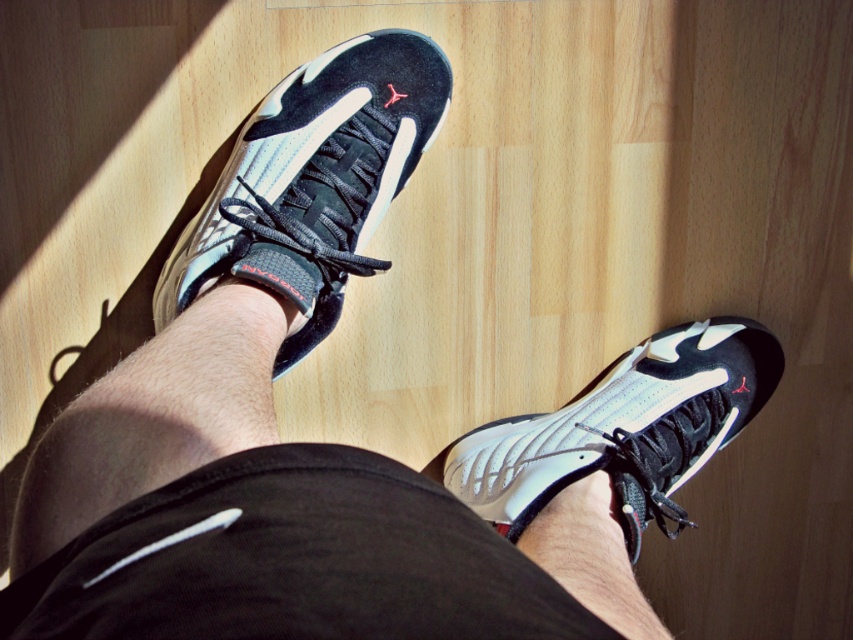
You are a shoe organizer trying to arrange these two pairs of shoes in a display case. The display case has two shelves, the top shelf is 14 inches wide and the bottom shelf is 12 inches wide. Which shelf should you place the white matte running shoe at center and the white matte sneaker at lower right on to ensure they fit without overlapping?

The white matte running shoe at center and white matte sneaker at lower right are 13.92 inches apart. Since the top shelf is 14 inches wide, which is just slightly larger than the distance between the two shoes, you should place them on the top shelf to ensure they fit without overlapping. The bottom shelf is only 12 inches wide, which would be too narrow.

You are a photographer setting up a shoot. You need to position a light source so that it illuminates the white matte running shoe at center and the white matte sneaker at lower right equally. Based on their positions, where should you place the light source relative to the two shoes?

The white matte running shoe at center is to the left of the white matte sneaker at lower right. To illuminate both equally, place the light source directly in front of the two shoes, equidistant from both.